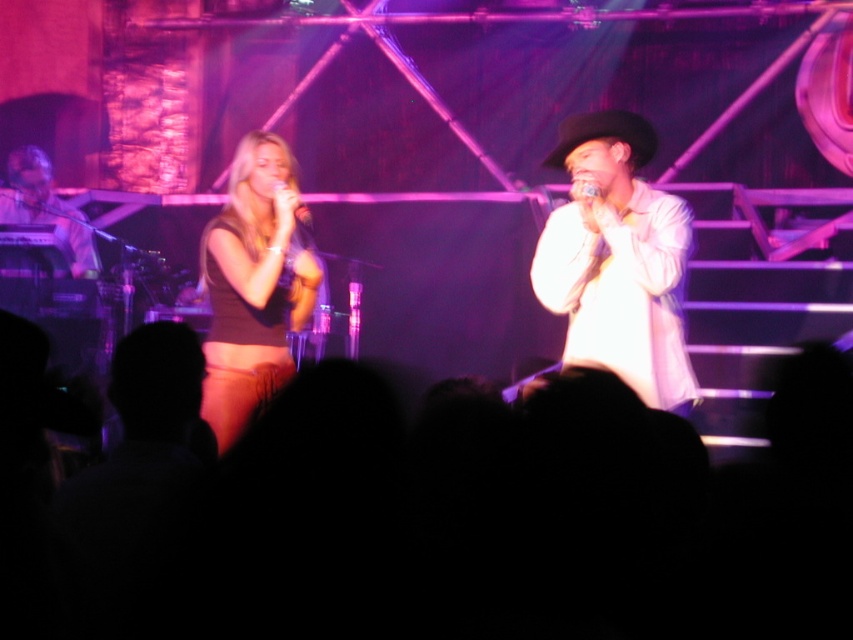
You are a photographer at the concert venue. You want to take a closeup shot of the matte black microphone at left. Where should you aim your camera to capture it?

The matte black microphone at left is located at point (45, 209), so aim your camera there to capture it.

You are a photographer at the concert venue and want to capture a closeup shot of the matte black top at center and the matte black microphone at center. Which object should you focus on first if you want to ensure both are in focus without adjusting the camera settings?

The matte black top at center is taller than the matte black microphone at center, so focusing on the matte black top at center first will help ensure both are in focus since it is larger and closer to the camera.